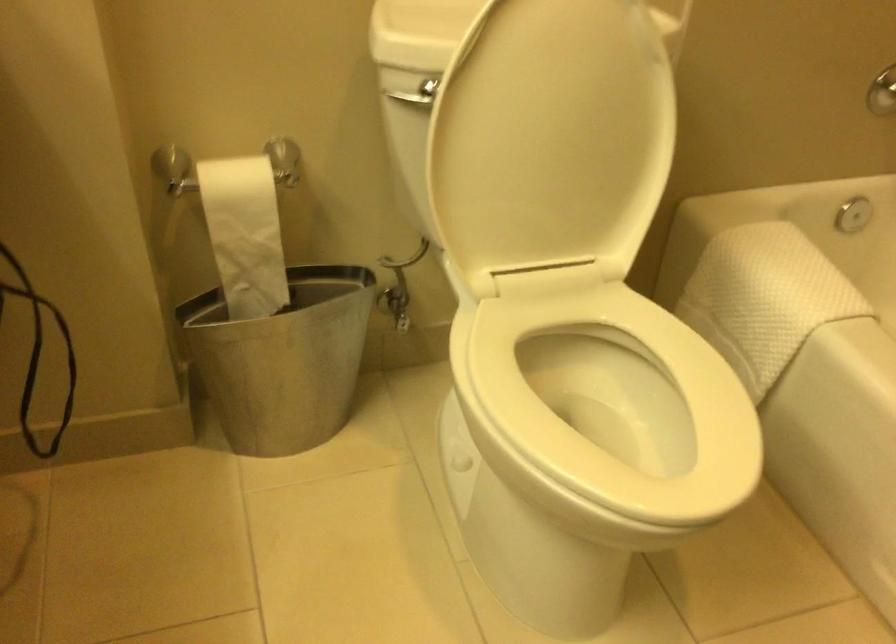
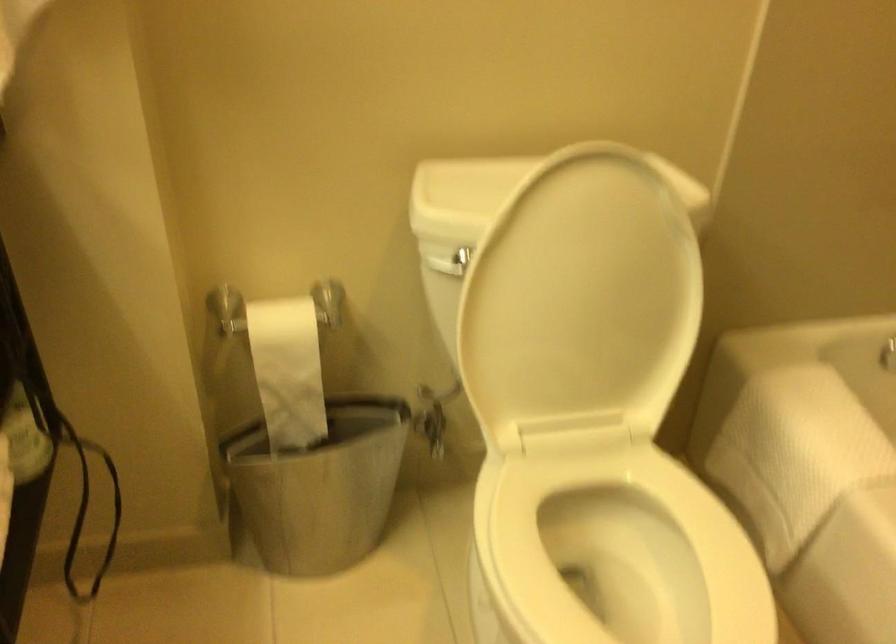
Locate, in the second image, the point that corresponds to point (244, 230) in the first image.

(288, 370)